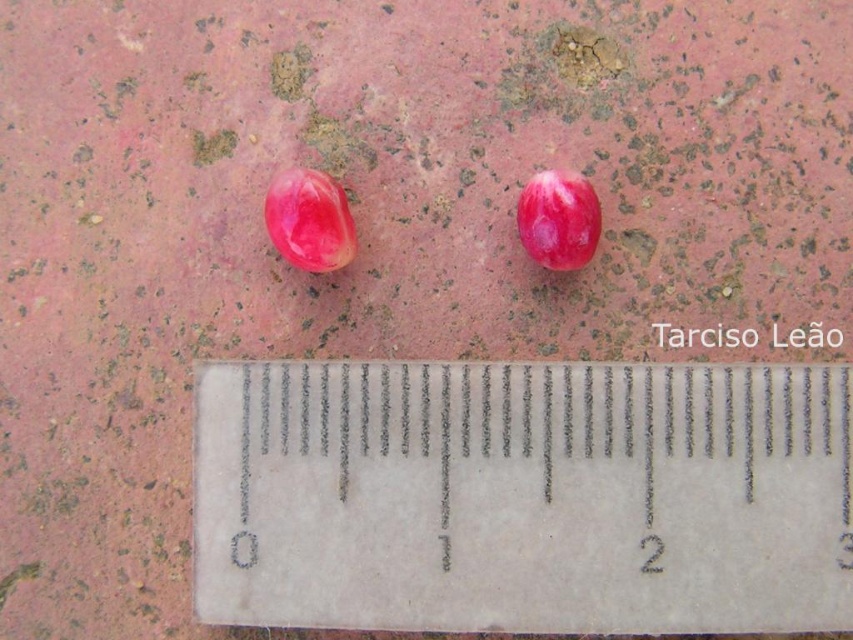
Where is the transparent plastic ruler at center located in the image?

The transparent plastic ruler at center is located at point (524, 497) in the image.

You are a gardener who wants to plant the glossy pink seed at center. You need to measure its length using the transparent plastic ruler at center. Which object should you move first to access the seed?

The transparent plastic ruler at center is positioned on the right side of the glossy pink seed at center, so you should move the transparent plastic ruler at center first to access the glossy pink seed at center.

You are a photographer trying to capture a closeup of the two red oval objects on the ground. Based on their positions, which of the two points, point (625, 420) or point (599, 208), should you focus on to ensure the closer object is in sharp focus?

Point (625, 420) is closer to the camera than point (599, 208), so focusing on point (625, 420) will ensure the closer object is in sharp focus.